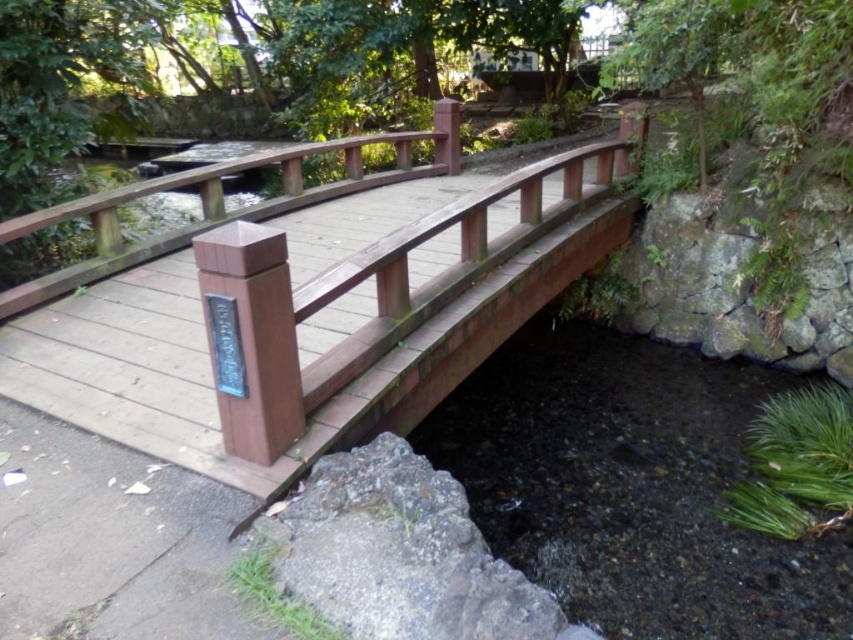
Question: Does wooden bridge at center appear over gray rough stone at lower left?

Choices:
 (A) yes
 (B) no

Answer: (A)

Question: Can you confirm if wooden bridge at center is positioned to the left of gray rough stone at lower left?

Choices:
 (A) yes
 (B) no

Answer: (B)

Question: Which of the following is the closest to the observer?

Choices:
 (A) (439, 604)
 (B) (144, 429)

Answer: (A)

Question: Among these points, which one is nearest to the camera?

Choices:
 (A) (631, 109)
 (B) (335, 452)

Answer: (B)

Question: Does wooden bridge at center have a lesser width compared to gray rough stone at lower left?

Choices:
 (A) no
 (B) yes

Answer: (A)

Question: Among these objects, which one is farthest from the camera?

Choices:
 (A) wooden bridge at center
 (B) gray rough stone at lower left

Answer: (A)